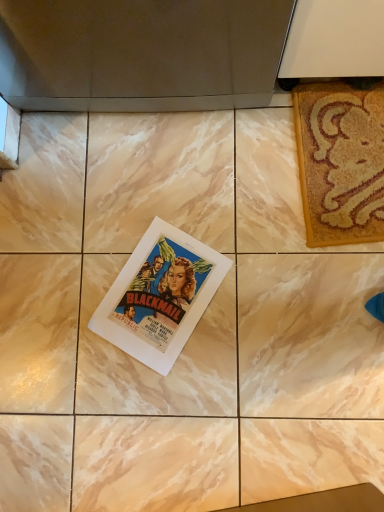
Where is `free point behind white paper at center`? Image resolution: width=384 pixels, height=512 pixels. free point behind white paper at center is located at coordinates (137, 198).